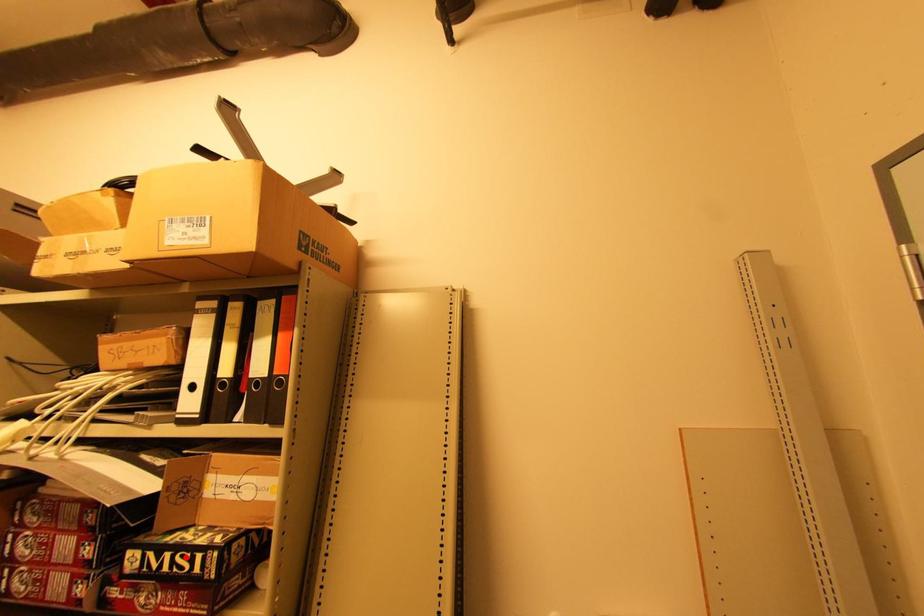
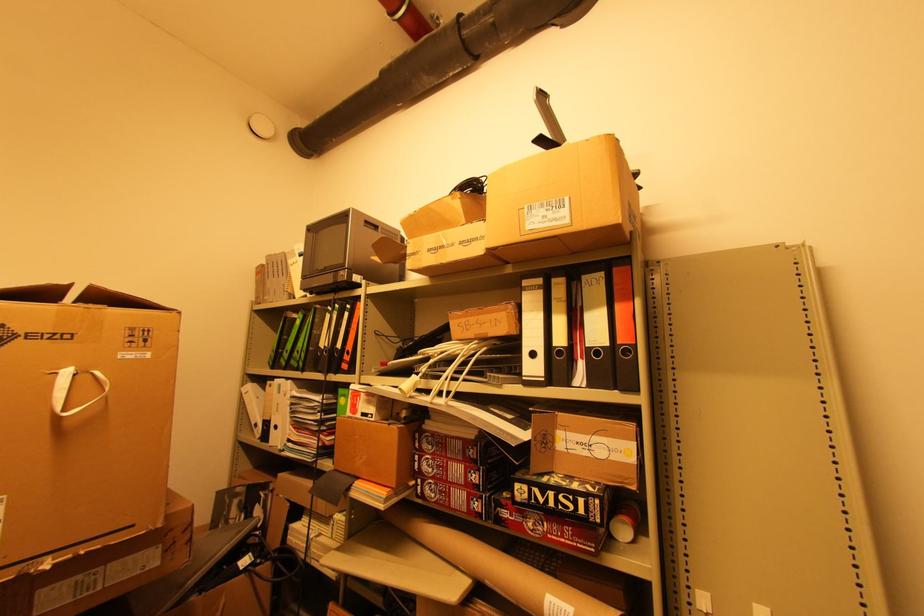
The point at the highlighted location is marked in the first image. Where is the corresponding point in the second image?

(568, 498)